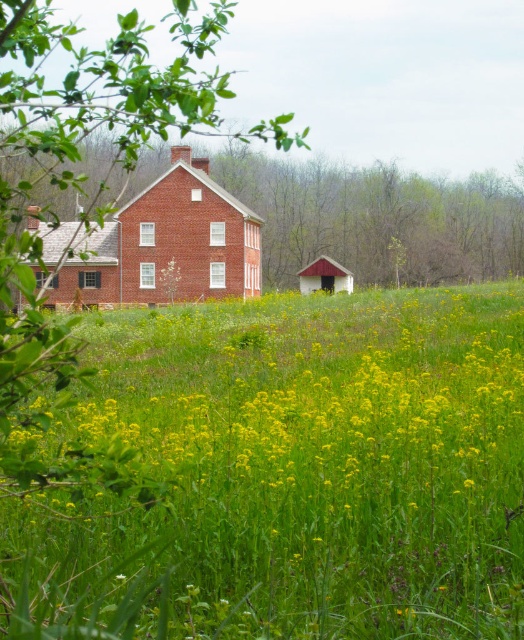
Question: Is green grassy field at center to the left of brick house at center from the viewer's perspective?

Choices:
 (A) no
 (B) yes

Answer: (A)

Question: Which point appears closest to the camera in this image?

Choices:
 (A) tap(202, 216)
 (B) tap(244, 436)

Answer: (B)

Question: Which point is farther from the camera taking this photo?

Choices:
 (A) (41, 273)
 (B) (206, 568)

Answer: (A)

Question: Is green grassy field at center smaller than brick house at center?

Choices:
 (A) no
 (B) yes

Answer: (B)

Question: Can you confirm if green grassy field at center is positioned to the left of brick house at center?

Choices:
 (A) no
 (B) yes

Answer: (A)